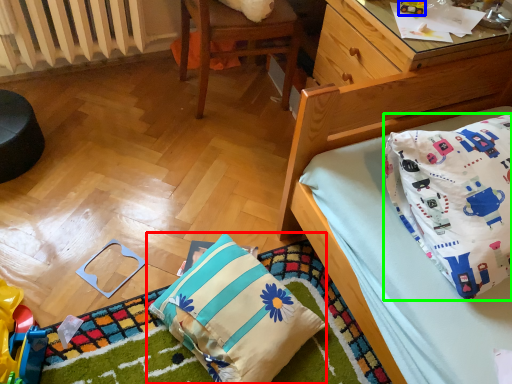
Question: Based on their relative distances, which object is farther from pillow (highlighted by a red box)? Choose from toy (highlighted by a blue box) and pillow (highlighted by a green box).

Choices:
 (A) toy
 (B) pillow

Answer: (A)